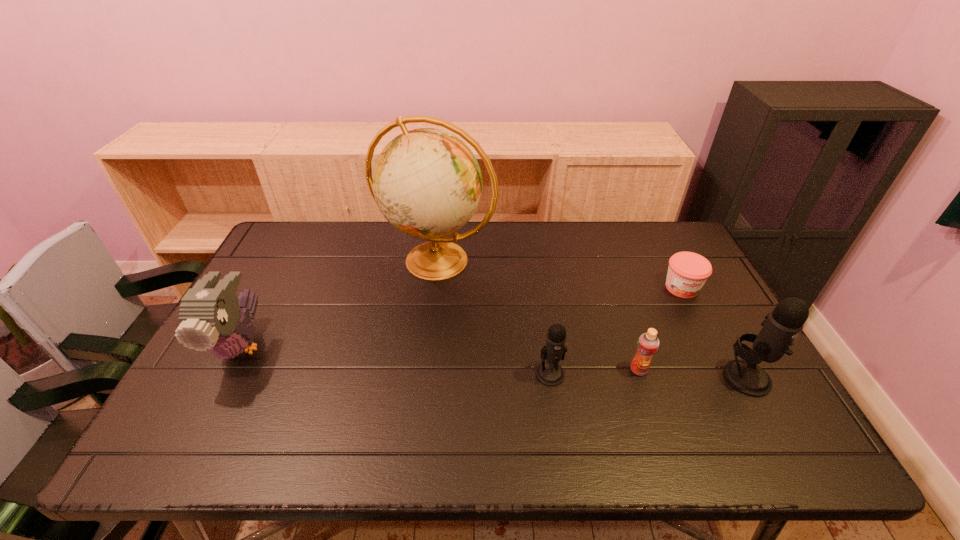
Identify the location of jam that is at the right edge. (687, 273).

This screenshot has height=540, width=960. Find the location of `object that is at the near right corner`. object that is at the near right corner is located at coordinates (783, 324).

You are a GUI agent. You are given a task and a screenshot of the screen. Output one action in this format:
    pyautogui.click(x=<x>, y=<y>)
    Task: Click on the free space at the far edge of the desktop
    
    Given the screenshot: What is the action you would take?
    pyautogui.click(x=370, y=231)

Where is `vacant space at the near edge of the desktop`? The width and height of the screenshot is (960, 540). vacant space at the near edge of the desktop is located at coordinates (690, 395).

I want to click on vacant space at the left edge of the desktop, so click(306, 270).

Identify the location of vacant point at the far left corner. The image size is (960, 540). (273, 248).

Find the location of a particular element. Image resolution: width=960 pixels, height=540 pixels. unoccupied position between the orange juice and the tallest object is located at coordinates (538, 315).

You are a GUI agent. You are given a task and a screenshot of the screen. Output one action in this format:
    pyautogui.click(x=<x>, y=<y>)
    Task: Click on the unoccupied area between the jam and the tallest object
    
    Given the screenshot: What is the action you would take?
    pyautogui.click(x=559, y=274)

Locate an element on the screen. Image resolution: width=960 pixels, height=540 pixels. empty location between the third object from left to right and the right microphone is located at coordinates (648, 375).

The width and height of the screenshot is (960, 540). I want to click on free space between the third tallest object and the third object from right to left, so click(440, 357).